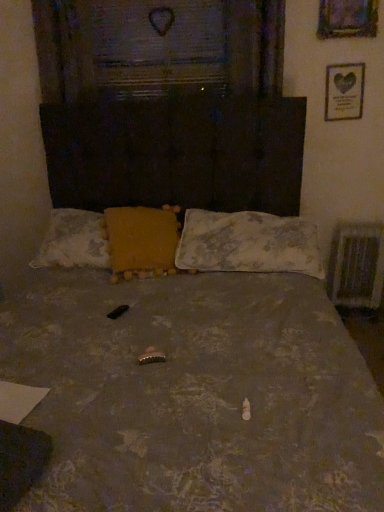
The height and width of the screenshot is (512, 384). Find the location of `wooden picture frame at upper right, positioned as the first picture frame in top-to-bottom order`. wooden picture frame at upper right, positioned as the first picture frame in top-to-bottom order is located at coordinates point(347,18).

Locate an element on the screen. The height and width of the screenshot is (512, 384). metallic silver radiator at right is located at coordinates (357, 265).

This screenshot has height=512, width=384. Describe the element at coordinates (357, 265) in the screenshot. I see `metallic silver radiator at right` at that location.

Identify the location of yellow fabric pillow at center, placed as the first pillow when sorted from left to right. The image size is (384, 512). point(141,241).

Image resolution: width=384 pixels, height=512 pixels. In order to click on wooden picture frame at upper right, acting as the 2th picture frame starting from the bottom in this screenshot , I will do `click(347, 18)`.

Is point (361, 287) closer or farther from the camera than point (220, 226)?

Clearly, point (361, 287) is more distant from the camera than point (220, 226).

Is metallic silver radiator at right oriented away from fluffy white pillow at center, acting as the first pillow starting from the right?

No.

Between metallic silver radiator at right and fluffy white pillow at center, acting as the first pillow starting from the right, which one has more height?

With more height is metallic silver radiator at right.

Is metallic silver radiator at right thinner than fluffy white pillow at center, acting as the first pillow starting from the right?

Correct, the width of metallic silver radiator at right is less than that of fluffy white pillow at center, acting as the first pillow starting from the right.

Choose the correct answer: Is yellow fabric pillow at center, placed as the first pillow when sorted from left to right, inside wooden picture frame at upper right, acting as the 2th picture frame starting from the bottom, or outside it?

yellow fabric pillow at center, placed as the first pillow when sorted from left to right, is not inside wooden picture frame at upper right, acting as the 2th picture frame starting from the bottom, it's outside.

Is yellow fabric pillow at center, placed as the first pillow when sorted from left to right, shorter than wooden picture frame at upper right, which is the second picture frame from back to front?

Yes, yellow fabric pillow at center, placed as the first pillow when sorted from left to right, is shorter than wooden picture frame at upper right, which is the second picture frame from back to front.

Is yellow fabric pillow at center, placed as the first pillow when sorted from left to right, bigger or smaller than wooden picture frame at upper right, acting as the 2th picture frame starting from the bottom?

In the image, yellow fabric pillow at center, placed as the first pillow when sorted from left to right, appears to be larger than wooden picture frame at upper right, acting as the 2th picture frame starting from the bottom.

Is yellow fabric pillow at center, acting as the 2th pillow starting from the right, to the left or to the right of wooden picture frame at upper right, acting as the 2th picture frame starting from the bottom, in the image?

Based on their positions, yellow fabric pillow at center, acting as the 2th pillow starting from the right, is located to the left of wooden picture frame at upper right, acting as the 2th picture frame starting from the bottom.

Measure the distance from yellow fabric pillow at center, acting as the 2th pillow starting from the right, to metallic silver radiator at right.

yellow fabric pillow at center, acting as the 2th pillow starting from the right, is 4.30 feet from metallic silver radiator at right.

Considering the relative positions of yellow fabric pillow at center, placed as the first pillow when sorted from left to right, and metallic silver radiator at right in the image provided, is yellow fabric pillow at center, placed as the first pillow when sorted from left to right, to the left of metallic silver radiator at right from the viewer's perspective?

Yes.

Can you confirm if yellow fabric pillow at center, placed as the first pillow when sorted from left to right, is bigger than metallic silver radiator at right?

Indeed, yellow fabric pillow at center, placed as the first pillow when sorted from left to right, has a larger size compared to metallic silver radiator at right.

Is yellow fabric pillow at center, placed as the first pillow when sorted from left to right, turned away from metallic silver radiator at right?

No.

Does point (354, 244) appear closer or farther from the camera than point (352, 106)?

Point (354, 244) is positioned farther from the camera compared to point (352, 106).

From a real-world perspective, does metallic silver radiator at right stand above gold metallic picture frame at upper right, which appears as the 1th picture frame when ordered from the bottom?

No.

Does metallic silver radiator at right lie in front of gold metallic picture frame at upper right, which appears as the 1th picture frame when viewed from the back?

No, metallic silver radiator at right is further to the viewer.

Is metallic silver radiator at right to the right of gold metallic picture frame at upper right, the second picture frame when ordered from top to bottom, from the viewer's perspective?

Indeed, metallic silver radiator at right is positioned on the right side of gold metallic picture frame at upper right, the second picture frame when ordered from top to bottom.

Considering the sizes of wooden picture frame at upper right, which ranks as the first picture frame in front-to-back order, and fluffy white pillow at center, acting as the first pillow starting from the right, in the image, is wooden picture frame at upper right, which ranks as the first picture frame in front-to-back order, wider or thinner than fluffy white pillow at center, acting as the first pillow starting from the right,?

In the image, wooden picture frame at upper right, which ranks as the first picture frame in front-to-back order, appears to be more narrow than fluffy white pillow at center, acting as the first pillow starting from the right.

Do you think wooden picture frame at upper right, positioned as the first picture frame in top-to-bottom order, is within fluffy white pillow at center, acting as the first pillow starting from the right, or outside of it?

The correct answer is: outside.

Is wooden picture frame at upper right, which ranks as the first picture frame in front-to-back order, oriented away from fluffy white pillow at center, arranged as the 2th pillow when viewed from the left?

No, wooden picture frame at upper right, which ranks as the first picture frame in front-to-back order,'s orientation is not away from fluffy white pillow at center, arranged as the 2th pillow when viewed from the left.

Which is further, (159,243) or (350,82)?

The point (350,82) is behind.

Find the location of a particular element. The height and width of the screenshot is (512, 384). picture frame that is the 1st object above the yellow fabric pillow at center, acting as the 2th pillow starting from the right (from a real-world perspective) is located at coordinates (344, 92).

Is yellow fabric pillow at center, acting as the 2th pillow starting from the right, spatially inside gold metallic picture frame at upper right, the second picture frame when ordered from top to bottom, or outside of it?

yellow fabric pillow at center, acting as the 2th pillow starting from the right, lies outside gold metallic picture frame at upper right, the second picture frame when ordered from top to bottom.

Could you measure the distance between yellow fabric pillow at center, acting as the 2th pillow starting from the right, and gold metallic picture frame at upper right, which appears as the 1th picture frame when viewed from the back?

yellow fabric pillow at center, acting as the 2th pillow starting from the right, and gold metallic picture frame at upper right, which appears as the 1th picture frame when viewed from the back, are 4.27 feet apart from each other.

Can you confirm if fluffy white pillow at center, acting as the first pillow starting from the right, is bigger than wooden picture frame at upper right, acting as the 2th picture frame starting from the bottom?

Yes, fluffy white pillow at center, acting as the first pillow starting from the right, is bigger than wooden picture frame at upper right, acting as the 2th picture frame starting from the bottom.

Could you measure the distance between fluffy white pillow at center, arranged as the 2th pillow when viewed from the left, and wooden picture frame at upper right, positioned as the first picture frame in top-to-bottom order?

fluffy white pillow at center, arranged as the 2th pillow when viewed from the left, is 3.96 feet from wooden picture frame at upper right, positioned as the first picture frame in top-to-bottom order.

From a real-world perspective, is fluffy white pillow at center, arranged as the 2th pillow when viewed from the left, located higher than wooden picture frame at upper right, which is the second picture frame from back to front?

Incorrect, from a real-world perspective, fluffy white pillow at center, arranged as the 2th pillow when viewed from the left, is lower than wooden picture frame at upper right, which is the second picture frame from back to front.

From the image's perspective, is fluffy white pillow at center, arranged as the 2th pillow when viewed from the left, above or below wooden picture frame at upper right, acting as the 2th picture frame starting from the bottom?

Clearly, from the image's perspective, fluffy white pillow at center, arranged as the 2th pillow when viewed from the left, is below wooden picture frame at upper right, acting as the 2th picture frame starting from the bottom.

From the image's perspective, count 1st pillows upward from the metallic silver radiator at right and point to it. Please provide its 2D coordinates.

[(248, 243)]

From a real-world perspective, starting from the wooden picture frame at upper right, which is the second picture frame from back to front, which pillow is the 1st one below it? Please provide its 2D coordinates.

[(141, 241)]

Considering their positions, is wooden picture frame at upper right, acting as the 2th picture frame starting from the bottom, positioned further to fluffy white pillow at center, arranged as the 2th pillow when viewed from the left, than metallic silver radiator at right?

wooden picture frame at upper right, acting as the 2th picture frame starting from the bottom.

Considering their positions, is wooden picture frame at upper right, positioned as the first picture frame in top-to-bottom order, positioned closer to yellow fabric pillow at center, placed as the first pillow when sorted from left to right, than metallic silver radiator at right?

Based on the image, metallic silver radiator at right appears to be nearer to yellow fabric pillow at center, placed as the first pillow when sorted from left to right.

Estimate the real-world distances between objects in this image. Which object is closer to wooden picture frame at upper right, which is the second picture frame from back to front, metallic silver radiator at right or yellow fabric pillow at center, acting as the 2th pillow starting from the right?

Based on the image, metallic silver radiator at right appears to be nearer to wooden picture frame at upper right, which is the second picture frame from back to front.

Considering their positions, is metallic silver radiator at right positioned closer to fluffy white pillow at center, acting as the first pillow starting from the right, than gold metallic picture frame at upper right, which appears as the 1th picture frame when ordered from the bottom?

Based on the image, metallic silver radiator at right appears to be nearer to fluffy white pillow at center, acting as the first pillow starting from the right.

Based on their spatial positions, is gold metallic picture frame at upper right, the second picture frame when ordered from top to bottom, or wooden picture frame at upper right, acting as the 2th picture frame starting from the bottom, closer to yellow fabric pillow at center, acting as the 2th pillow starting from the right?

The object closer to yellow fabric pillow at center, acting as the 2th pillow starting from the right, is gold metallic picture frame at upper right, the second picture frame when ordered from top to bottom.

Consider the image. Estimate the real-world distances between objects in this image. Which object is closer to wooden picture frame at upper right, which is the second picture frame from back to front, yellow fabric pillow at center, placed as the first pillow when sorted from left to right, or metallic silver radiator at right?

Among the two, metallic silver radiator at right is located nearer to wooden picture frame at upper right, which is the second picture frame from back to front.

Considering their positions, is yellow fabric pillow at center, placed as the first pillow when sorted from left to right, positioned further to fluffy white pillow at center, arranged as the 2th pillow when viewed from the left, than wooden picture frame at upper right, which is the second picture frame from back to front?

The object further to fluffy white pillow at center, arranged as the 2th pillow when viewed from the left, is wooden picture frame at upper right, which is the second picture frame from back to front.

Which object lies nearer to the anchor point metallic silver radiator at right, fluffy white pillow at center, arranged as the 2th pillow when viewed from the left, or yellow fabric pillow at center, placed as the first pillow when sorted from left to right?

Among the two, fluffy white pillow at center, arranged as the 2th pillow when viewed from the left, is located nearer to metallic silver radiator at right.

You are a GUI agent. You are given a task and a screenshot of the screen. Output one action in this format:
    pyautogui.click(x=<x>, y=<y>)
    Task: Click on the pillow between wooden picture frame at upper right, which ranks as the first picture frame in front-to-back order, and fluffy white pillow at center, arranged as the 2th pillow when viewed from the left, vertically
    This screenshot has height=512, width=384.
    Given the screenshot: What is the action you would take?
    pyautogui.click(x=141, y=241)

Locate an element on the screen. Image resolution: width=384 pixels, height=512 pixels. pillow between yellow fabric pillow at center, placed as the first pillow when sorted from left to right, and metallic silver radiator at right from left to right is located at coordinates click(248, 243).

Image resolution: width=384 pixels, height=512 pixels. I want to click on picture frame that lies between wooden picture frame at upper right, positioned as the first picture frame in top-to-bottom order, and yellow fabric pillow at center, acting as the 2th pillow starting from the right, from top to bottom, so click(x=344, y=92).

Find the location of `picture frame between wooden picture frame at upper right, acting as the 2th picture frame starting from the bottom, and metallic silver radiator at right, in the vertical direction`. picture frame between wooden picture frame at upper right, acting as the 2th picture frame starting from the bottom, and metallic silver radiator at right, in the vertical direction is located at coordinates (344, 92).